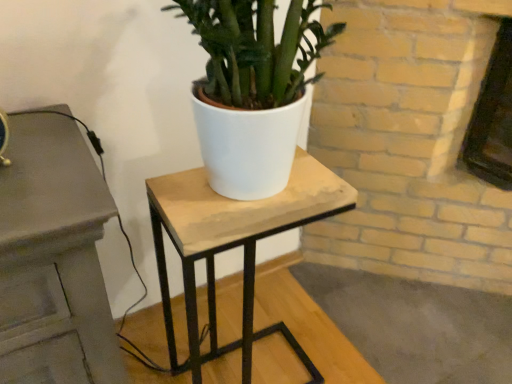
Locate an element on the screen. This screenshot has width=512, height=384. vacant area situated below wooden table at center (from a real-world perspective) is located at coordinates (246, 361).